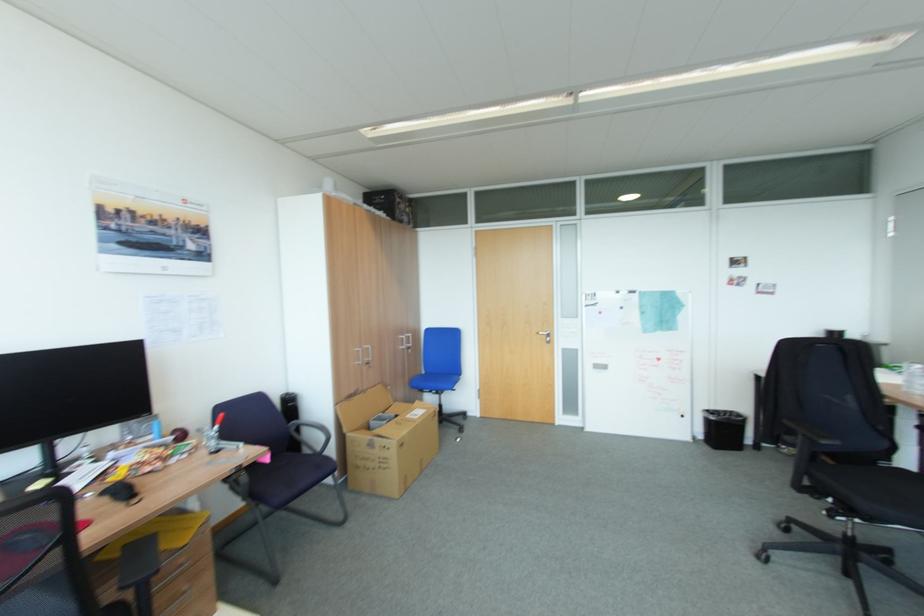
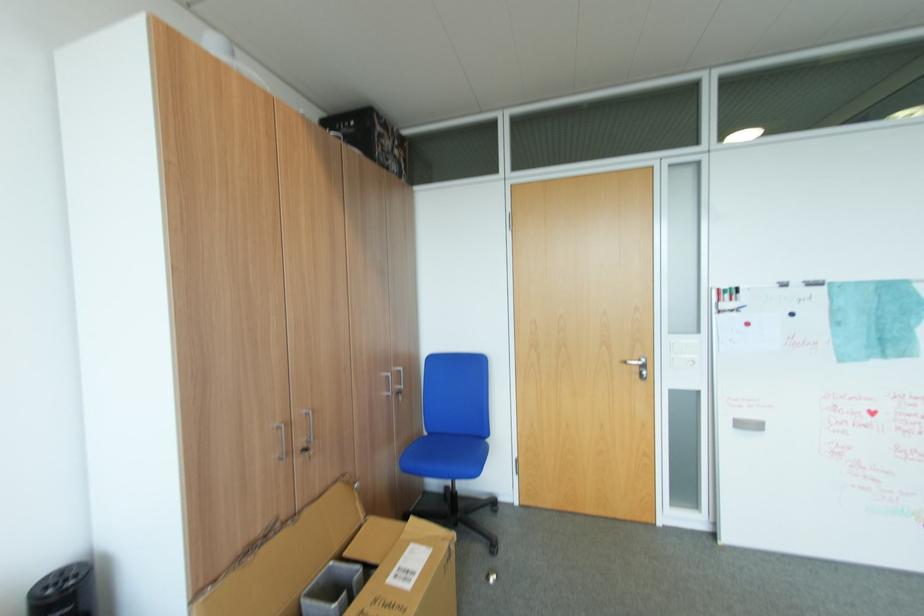
The point at (x=379, y=421) is marked in the first image. Where is the corresponding point in the second image?

(317, 593)